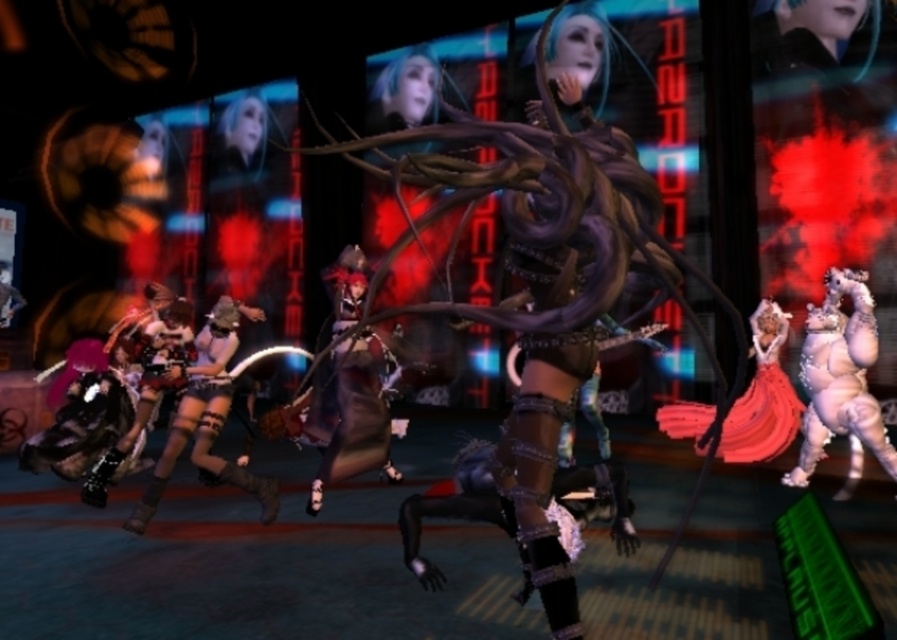
You are a character in the scene and need to quickly grab an item. The shiny metallic armor at lower left and the shiny satin dress at right are both nearby. Which one is closer to you?

The shiny metallic armor at lower left is closer because it is in front of the shiny satin dress at right.

In the futuristic cyberpunk scene, there are two items of clothing present. The shiny black armor at center and the shiny satin dress at right. Which one is positioned to the left?

The shiny black armor at center is to the left of the shiny satin dress at right.